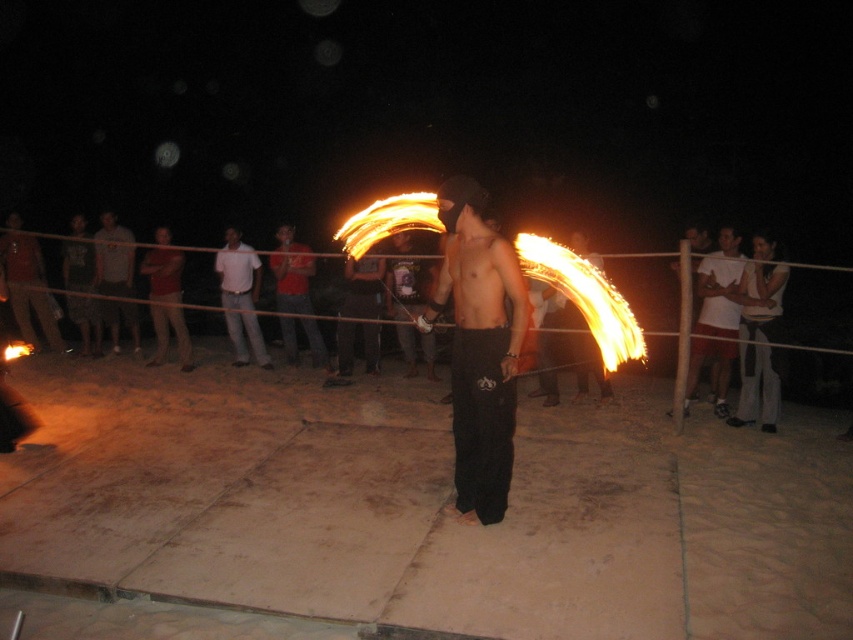
Is shiny black pants at center bigger than shiny metallic fire spinner at center?

Yes.

The height and width of the screenshot is (640, 853). I want to click on shiny black pants at center, so click(479, 348).

Between shiny metallic pants at center and white cotton shirt at left, which one has more height?

Standing taller between the two is shiny metallic pants at center.

Is shiny metallic pants at center to the left of white cotton shirt at left from the viewer's perspective?

No, shiny metallic pants at center is not to the left of white cotton shirt at left.

You are a GUI agent. You are given a task and a screenshot of the screen. Output one action in this format:
    pyautogui.click(x=<x>, y=<y>)
    Task: Click on the shiny metallic pants at center
    
    Given the screenshot: What is the action you would take?
    pyautogui.click(x=405, y=285)

Who is more distant from viewer, (238, 321) or (704, 230)?

Point (238, 321)

Which is in front, point (241, 348) or point (714, 376)?

Point (714, 376) is in front.

Which is behind, point (258, 326) or point (691, 257)?

The point (258, 326) is more distant.

Locate an element on the screen. The image size is (853, 640). white cotton shirt at center is located at coordinates (241, 298).